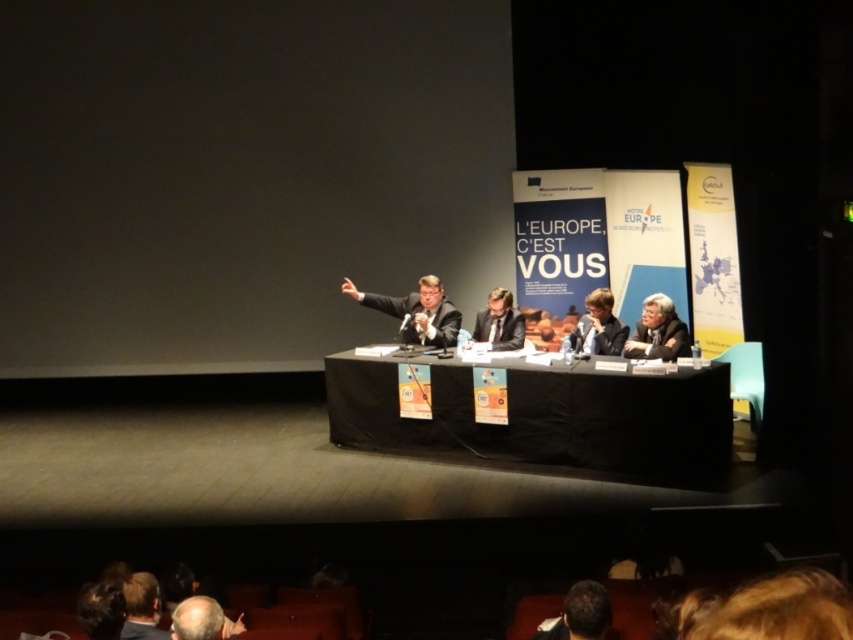
Question: Which of the following is the closest to the observer?

Choices:
 (A) dark suit at center
 (B) matte black suit at center
 (C) black fabric table at center

Answer: (C)

Question: Is black fabric table at center bigger than matte black suit at right?

Choices:
 (A) yes
 (B) no

Answer: (A)

Question: Can you confirm if black fabric table at center is positioned to the left of light brown hair at lower center?

Choices:
 (A) yes
 (B) no

Answer: (B)

Question: Among these points, which one is farthest from the camera?

Choices:
 (A) (723, 387)
 (B) (656, 305)

Answer: (B)

Question: Which object is farther from the camera taking this photo?

Choices:
 (A) dark suit at center
 (B) matte black suit at center
 (C) matte black suit at right
 (D) light brown hair at lower center

Answer: (B)

Question: In this image, where is matte black suit at right located relative to light brown hair at lower center?

Choices:
 (A) left
 (B) right

Answer: (B)